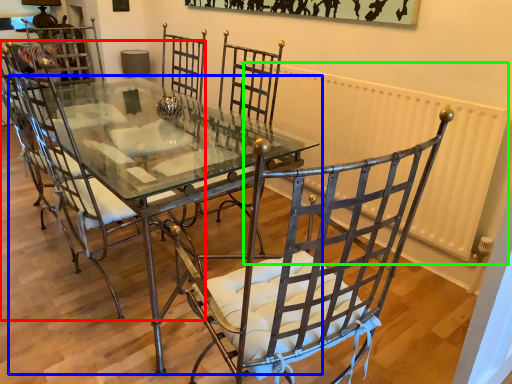
Question: Considering the real-world distances, which object is farthest from chair (highlighted by a red box)? table (highlighted by a blue box) or radiator (highlighted by a green box)?

Choices:
 (A) table
 (B) radiator

Answer: (B)